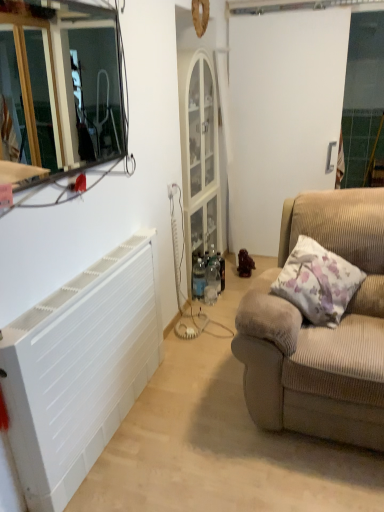
This screenshot has height=512, width=384. Identify the location of empty space that is ontop of white matte door at center (from a real-world perspective). (309, 8).